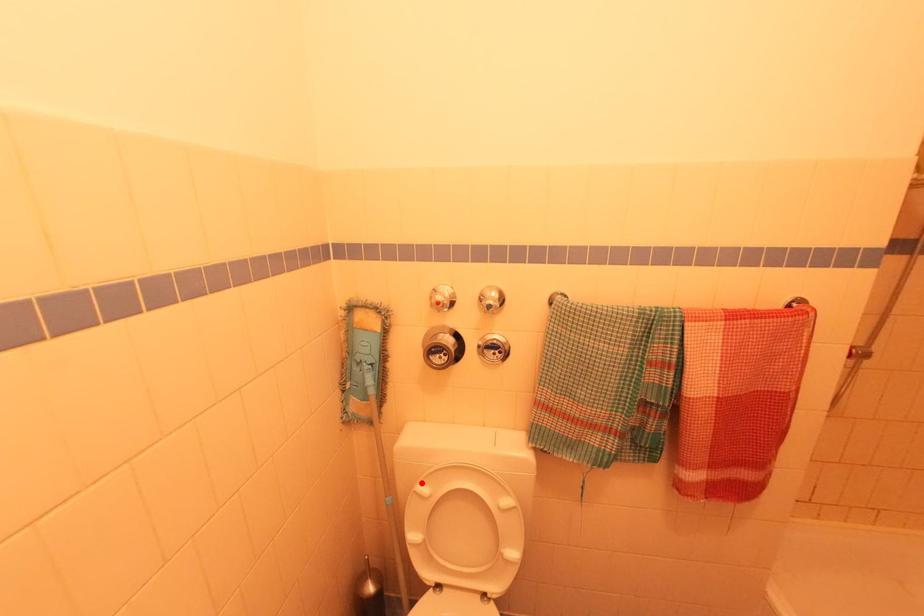
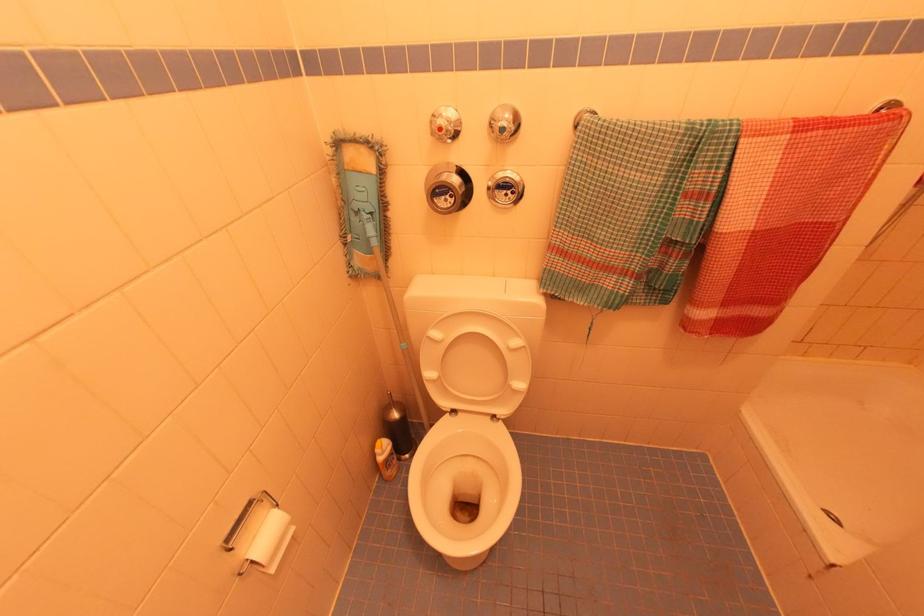
Locate, in the second image, the point that corresponds to the highlighted location in the first image.

(433, 329)